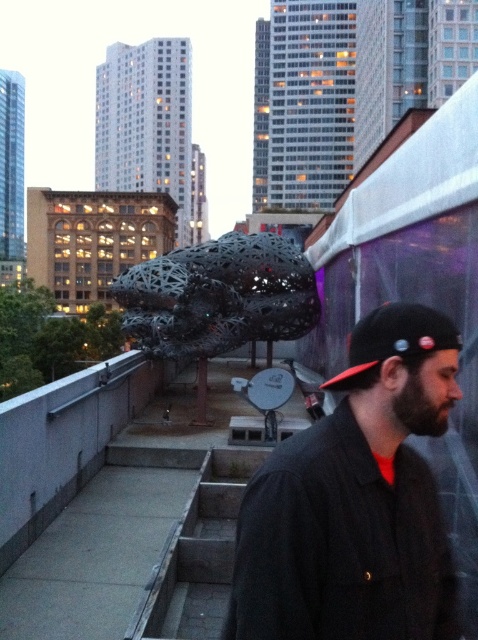
You are standing on the rooftop and want to walk from the man to the sculpture. Which point, point (232, 289) or point (459, 346), is closer to you as you start your journey?

Point (232, 289) is closer to you because it is further to the viewer than point (459, 346), which means it is physically nearer in the scene.

You are a photographer trying to capture the sculpture in the center of the image. You want to ensure that the black matte jacket at right is not blocking the view of the sculpture. Based on its position, can you determine if the jacket is in front of or behind the sculpture?

The black matte jacket at right is positioned at point (x=356, y=500), which places it in front of the sculpture, potentially blocking the view.

You are a photographer trying to capture the man in the scene. Since you want to focus on his clothing, which object, the black matte jacket at right or the black fabric baseball cap at right, should you adjust your camera to focus on first considering their sizes?

The black matte jacket at right has a greater height compared to the black fabric baseball cap at right, so you should focus on the black matte jacket at right first as it is larger.